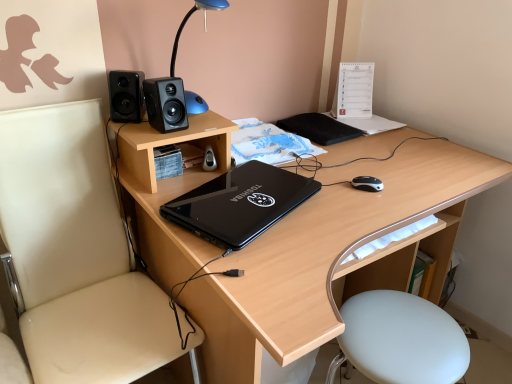
Question: Should I look upward or downward to see black matte speaker at upper left, arranged as the 2th speaker when viewed from the right?

Choices:
 (A) down
 (B) up

Answer: (B)

Question: Is black glossy laptop at center aimed at white leather bar stool at lower right?

Choices:
 (A) yes
 (B) no

Answer: (B)

Question: Is black glossy laptop at center closer to the viewer compared to white leather bar stool at lower right?

Choices:
 (A) no
 (B) yes

Answer: (B)

Question: Considering the relative sizes of black glossy laptop at center and white leather bar stool at lower right in the image provided, is black glossy laptop at center thinner than white leather bar stool at lower right?

Choices:
 (A) yes
 (B) no

Answer: (A)

Question: Can you confirm if black glossy laptop at center is bigger than white leather bar stool at lower right?

Choices:
 (A) no
 (B) yes

Answer: (A)

Question: Would you say black glossy laptop at center is outside white leather bar stool at lower right?

Choices:
 (A) yes
 (B) no

Answer: (A)

Question: Would you consider black glossy laptop at center to be distant from white leather bar stool at lower right?

Choices:
 (A) yes
 (B) no

Answer: (B)

Question: Does beige leather chair at left lie behind black matte notepad at upper right?

Choices:
 (A) yes
 (B) no

Answer: (B)

Question: Is beige leather chair at left looking in the opposite direction of black matte notepad at upper right?

Choices:
 (A) no
 (B) yes

Answer: (A)

Question: Is beige leather chair at left completely or partially outside of black matte notepad at upper right?

Choices:
 (A) yes
 (B) no

Answer: (A)

Question: Can you confirm if beige leather chair at left is taller than black matte notepad at upper right?

Choices:
 (A) yes
 (B) no

Answer: (A)

Question: From a real-world perspective, is beige leather chair at left located higher than black matte notepad at upper right?

Choices:
 (A) no
 (B) yes

Answer: (A)

Question: Is beige leather chair at left smaller than black matte notepad at upper right?

Choices:
 (A) yes
 (B) no

Answer: (B)

Question: Could you tell me if black matte notepad at upper right is turned towards black matte speaker at upper center, arranged as the 2th speaker when viewed from the left?

Choices:
 (A) no
 (B) yes

Answer: (A)